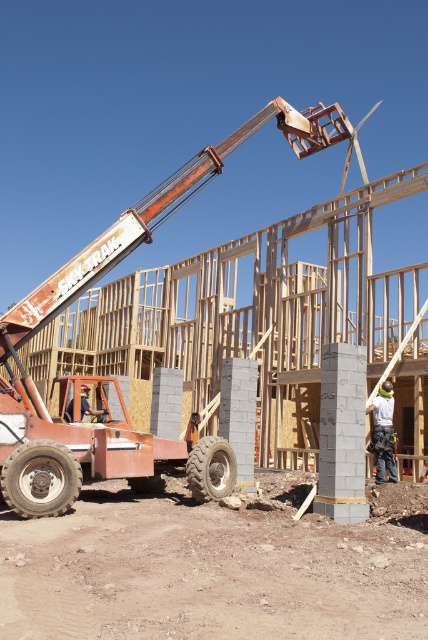
Is orange metallic crane at center thinner than white hard hat at center?

In fact, orange metallic crane at center might be wider than white hard hat at center.

Does orange metallic crane at center appear on the right side of white hard hat at center?

Incorrect, orange metallic crane at center is not on the right side of white hard hat at center.

Does point (318, 113) lie behind point (380, 456)?

Yes.

Find the location of `orange metallic crane at center`. orange metallic crane at center is located at coordinates (113, 376).